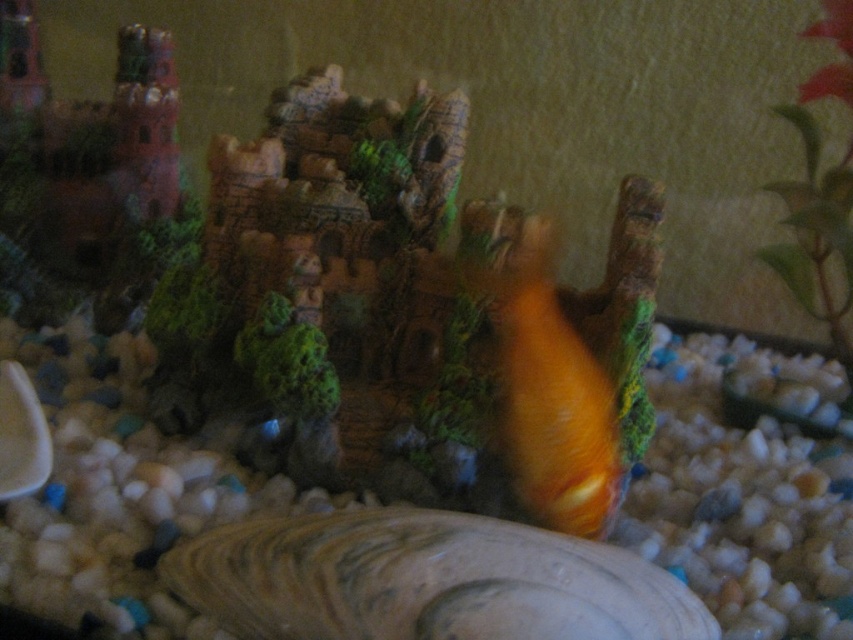
Question: Which of the following is the farthest from the observer?

Choices:
 (A) (601, 372)
 (B) (813, 316)

Answer: (B)

Question: Among these objects, which one is farthest from the camera?

Choices:
 (A) orange matte goldfish at center
 (B) green leafy plant at upper right

Answer: (B)

Question: Does orange matte goldfish at center appear over green leafy plant at upper right?

Choices:
 (A) yes
 (B) no

Answer: (B)

Question: Is orange matte goldfish at center above green leafy plant at upper right?

Choices:
 (A) no
 (B) yes

Answer: (A)

Question: Can you confirm if orange matte goldfish at center is thinner than green leafy plant at upper right?

Choices:
 (A) yes
 (B) no

Answer: (A)